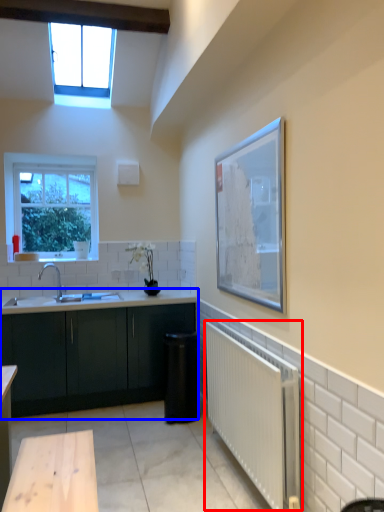
Question: Which object is further to the camera taking this photo, radiator (highlighted by a red box) or cabinetry (highlighted by a blue box)?

Choices:
 (A) radiator
 (B) cabinetry

Answer: (B)